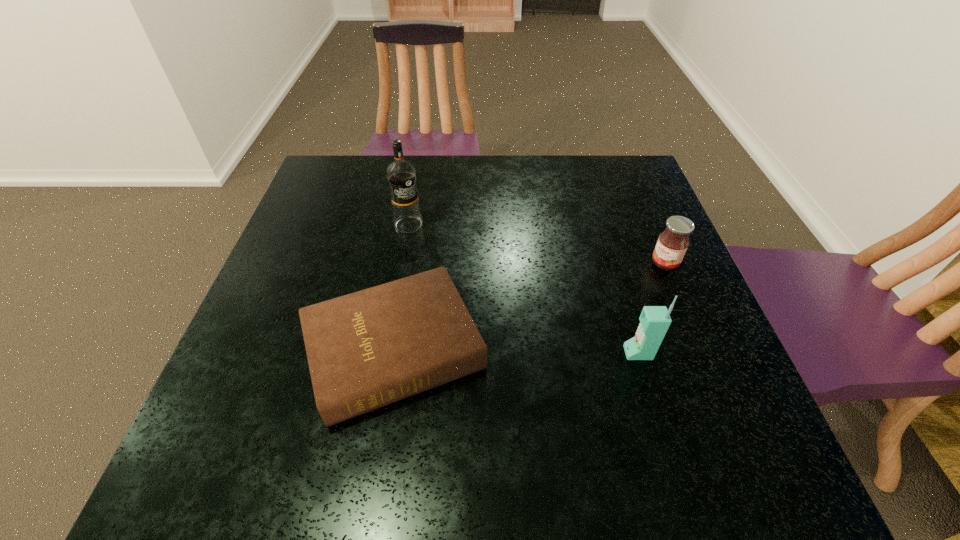
At what (x,y) coordinates should I click in order to perform the action: click on free space on the desktop that is between the shortest object and the second tallest object and is positioned on the label side of the rightmost object. Please return your answer as a coordinate pair (x, y). Looking at the image, I should click on pos(541,352).

What are the coordinates of `free spot on the desktop that is between the shortest object and the second tallest object and is positioned on the label of the farthest object` in the screenshot? It's located at (499, 352).